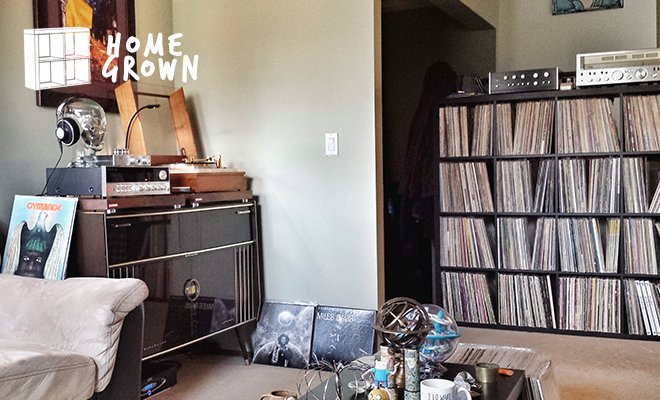
Locate an element on the screen. The image size is (660, 400). lightswitch is located at coordinates (334, 144).